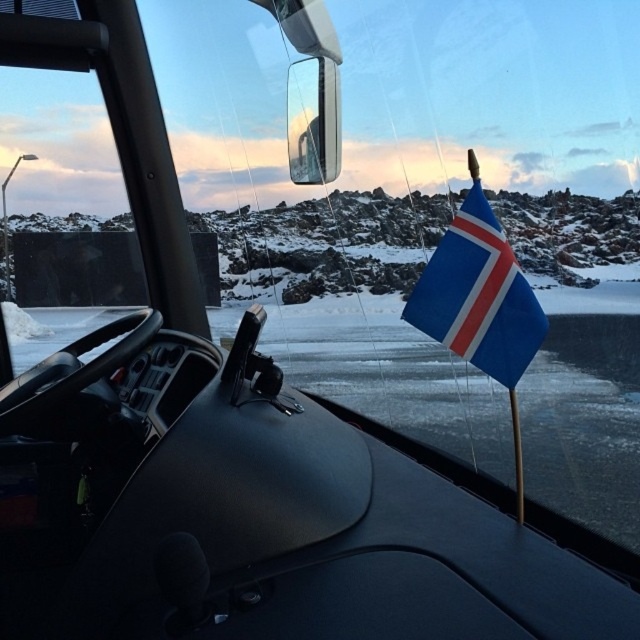
Based on the photo, can you confirm if blue fabric flag at center is shorter than glossy plastic view mirror at upper center?

Result: Correct, blue fabric flag at center is not as tall as glossy plastic view mirror at upper center.

Which of these two, blue fabric flag at center or glossy plastic view mirror at upper center, stands taller?

With more height is glossy plastic view mirror at upper center.

Where is `blue fabric flag at center`? This screenshot has height=640, width=640. blue fabric flag at center is located at coordinates (477, 296).

I want to click on blue fabric flag at center, so (477, 296).